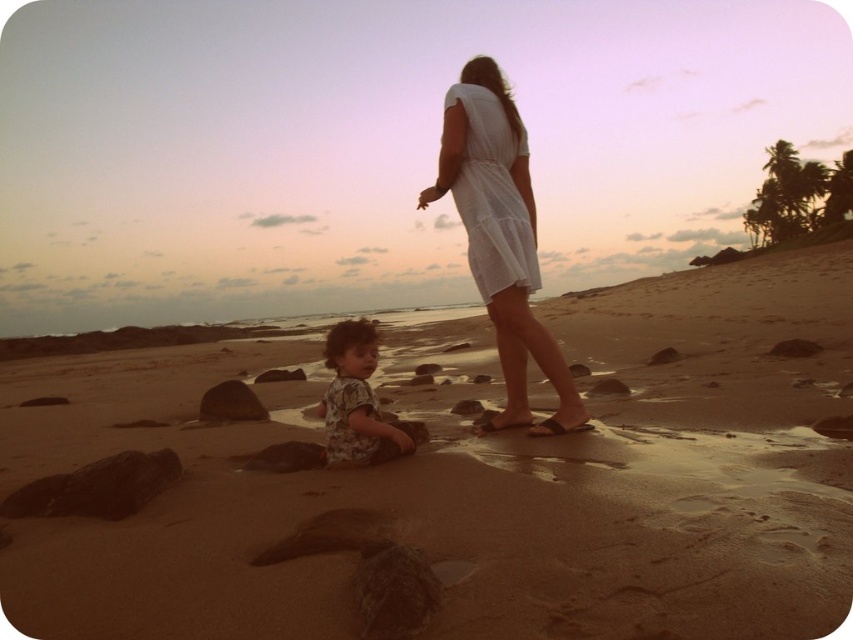
Question: Which of the following is the farthest from the observer?

Choices:
 (A) (129, 492)
 (B) (469, 184)

Answer: (B)

Question: Estimate the real-world distances between objects in this image. Which object is farther from the matte brown sandal at lower center?

Choices:
 (A) white cotton dress at center
 (B) smooth brown rock at lower left
 (C) smooth brown rock at center

Answer: (C)

Question: Where is white cotton dress at upper center located in relation to rusty metallic rock at lower left in the image?

Choices:
 (A) above
 (B) below

Answer: (A)

Question: Which object is closer to the camera taking this photo?

Choices:
 (A) rusty metallic rock at lower left
 (B) matte brown sandal at lower center
 (C) white cotton dress at upper center
 (D) smooth brown rock at lower center

Answer: (A)

Question: Does white cotton dress at upper center appear on the left side of smooth brown rock at center?

Choices:
 (A) no
 (B) yes

Answer: (B)

Question: Is rusty metallic rock at lower left to the right of smooth brown rock at lower center from the viewer's perspective?

Choices:
 (A) yes
 (B) no

Answer: (A)